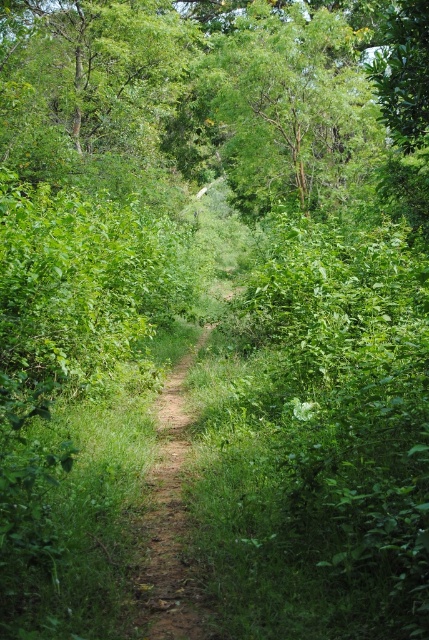
You are a hiker planning to walk along the dirt path at center. You notice a green leafy tree at upper center nearby. Considering their heights, which one is taller?

The green leafy tree at upper center is taller than the dirt path at center.

You are a hiker walking along the dirt path at center. You notice the green leafy tree at upper center ahead. Which direction should you walk to get closer to the tree?

The green leafy tree at upper center is further to the viewer than the dirt path at center, so to get closer to the tree, you should walk forward along the dirt path at center towards the tree.

You are a hiker walking along the dirt path at center and notice a green leafy tree at upper center. Which one is wider in terms of their horizontal spread?

The green leafy tree at upper center is wider than the dirt path at center in terms of their horizontal spread.